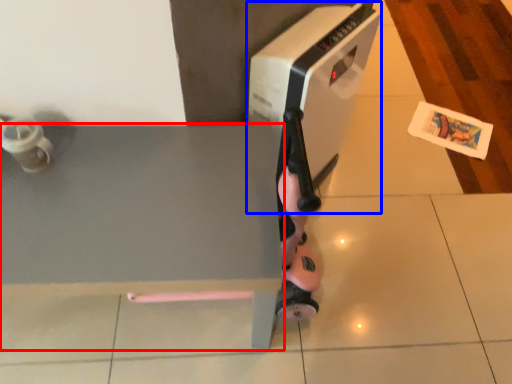
Question: Which point is closer to the camera, table (highlighted by a red box) or home appliance (highlighted by a blue box)?

Choices:
 (A) table
 (B) home appliance

Answer: (A)